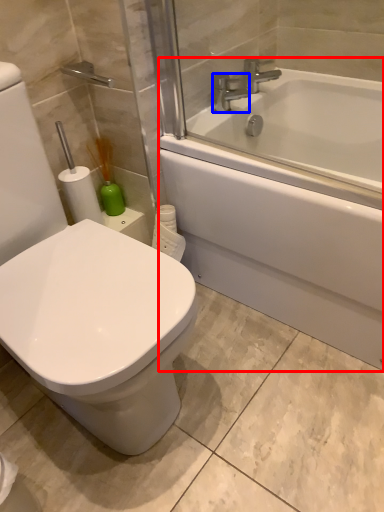
Question: Which object is closer to the camera taking this photo, bathtub (highlighted by a red box) or faucet (highlighted by a blue box)?

Choices:
 (A) bathtub
 (B) faucet

Answer: (A)